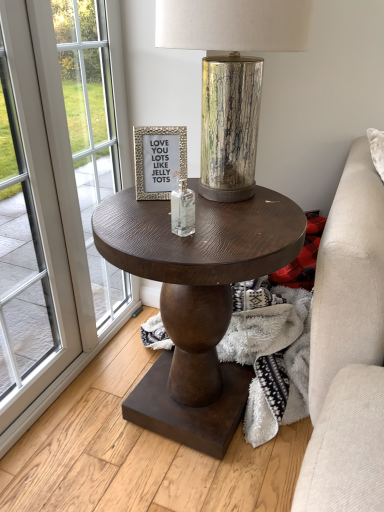
Question: Looking at the image, does dark wood round table at center seem bigger or smaller compared to silver textured frame at center?

Choices:
 (A) small
 (B) big

Answer: (B)

Question: Considering the positions of point (162, 209) and point (145, 172), is point (162, 209) closer or farther from the camera than point (145, 172)?

Choices:
 (A) farther
 (B) closer

Answer: (B)

Question: Which of these objects is positioned farthest from the white glass screen door at left?

Choices:
 (A) dark wood round table at center
 (B) silver textured frame at center
 (C) gold textured lamp at center
 (D) clear glass bottle at center
 (E) white glass window at left

Answer: (D)

Question: Which is nearer to the gold textured lamp at center?

Choices:
 (A) white glass window at left
 (B) clear glass bottle at center
 (C) white glass screen door at left
 (D) silver textured frame at center
 (E) dark wood round table at center

Answer: (D)